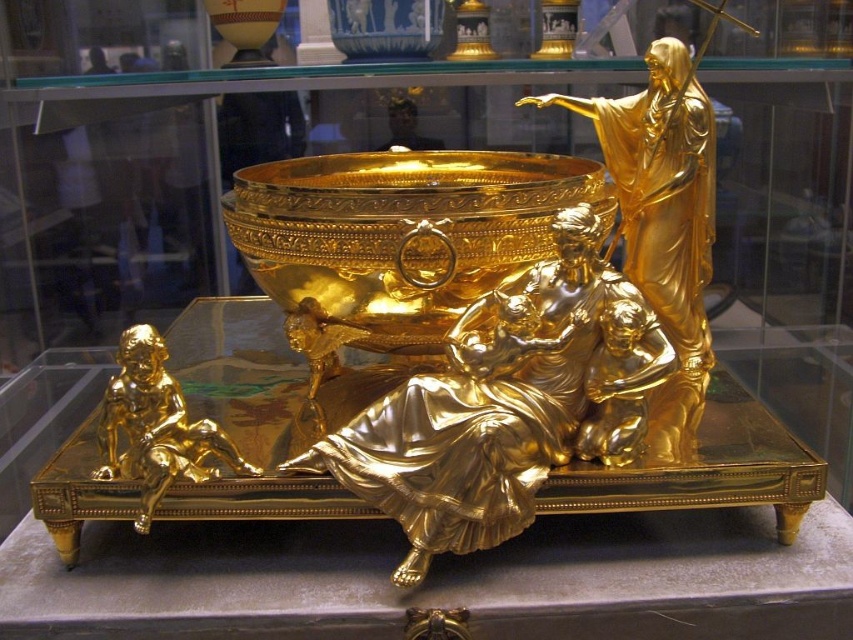
You are an art conservator examining the sculpture in the glass case. You need to determine which object requires a taller protective cover. Which one is taller between the gold polished statue at center and the gold polished cherub at lower left?

The gold polished statue at center is much taller than the gold polished cherub at lower left, so it requires a taller protective cover.

From the picture: You are a museum visitor standing in front of the glass case. You want to take a photo of the gold polished statue at center without any obstruction. Is the gold polished cherub at lower left blocking your view?

The gold polished cherub at lower left is behind the gold polished statue at center, so it won not block your view of the gold polished statue at center.